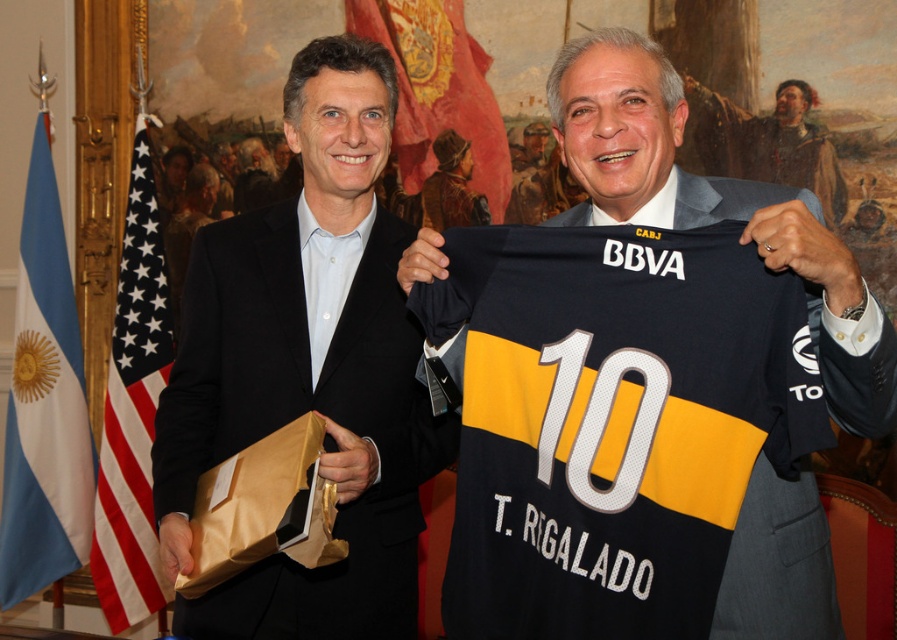
You are a photographer setting up for a formal event. You notice two items in the scene that need to be positioned symmetrically around the center axis of the image. The items are the brown leather jacket at upper center and the white smooth shirt at center. Which item should be moved to the left to achieve symmetry?

The brown leather jacket at upper center should be moved to the left to align it symmetrically with the white smooth shirt at center since it is currently positioned to the right of the shirt.

What is the color of the area where the point at coordinates [308,369] is located?

The point at coordinates [308,369] is located on the matte black suit at left, so the color is matte black.